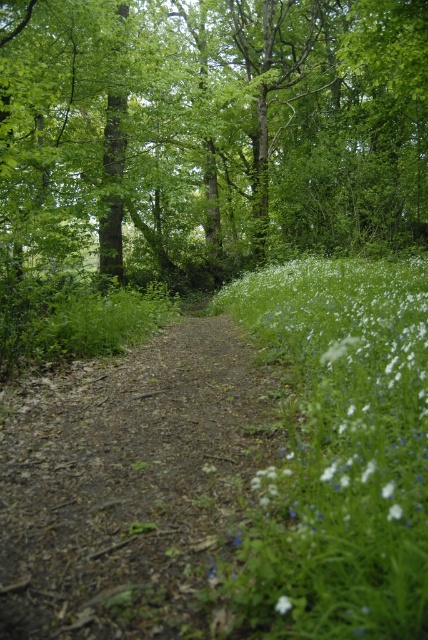
From the picture: Measure the distance between white soft grass at right and camera.

The distance of white soft grass at right from camera is 1.62 meters.

Is white soft grass at right smaller than white matte flower at lower right?

No.

What do you see at coordinates (348, 388) in the screenshot? I see `white soft grass at right` at bounding box center [348, 388].

Where is `white soft grass at right`? The width and height of the screenshot is (428, 640). white soft grass at right is located at coordinates (348, 388).

The width and height of the screenshot is (428, 640). Find the location of `green leafy tree at center`. green leafy tree at center is located at coordinates (211, 131).

Can you confirm if green leafy tree at center is taller than white soft grass at right?

Yes.

Locate an element on the screen. This screenshot has height=640, width=428. green leafy tree at center is located at coordinates (211, 131).

From the picture: Is green leafy tree at center bigger than white matte flower at lower center?

Correct, green leafy tree at center is larger in size than white matte flower at lower center.

Does green leafy tree at center have a smaller size compared to white matte flower at lower center?

Incorrect, green leafy tree at center is not smaller in size than white matte flower at lower center.

Between point (136, 182) and point (290, 608), which one is positioned in front?

Positioned in front is point (290, 608).

Find the location of a particular element. The width and height of the screenshot is (428, 640). green leafy tree at center is located at coordinates (211, 131).